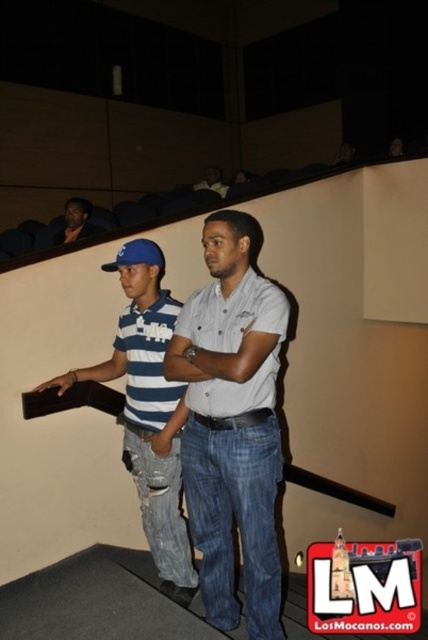
You are sitting in the front row of the theater and want to hand a note to the person wearing the light blue denim jeans at center and the blue striped shirt at center. Which clothing item should you target first to ensure your note reaches the correct person?

The light blue denim jeans at center is closer to the viewer than the blue striped shirt at center, so you should target the light blue denim jeans at center first to ensure the note reaches the correct person.

You are a photographer trying to capture a candid shot of both the blue striped shirt at center and the matte black shirt at upper center. Based on their positions, which subject would you need to frame first in your camera to ensure they are fully visible in the photo?

The blue striped shirt at center is taller than the matte black shirt at upper center, so you should frame the blue striped shirt at center first to ensure it fits within the camera frame before adjusting for the smaller matte black shirt at upper center.

You are a photographer trying to capture a candid shot of the two people in the image. You need to know if there is enough space between the light blue denim jeans at center and the blue striped shirt at center to fit a small 10 inch wide camera lens between them without moving the subjects. Can you determine if the space between them is sufficient?

The light blue denim jeans at center and blue striped shirt at center are 12.72 inches apart. Since the camera lens is 10 inches wide, the space between them is sufficient to fit the lens without moving the subjects.